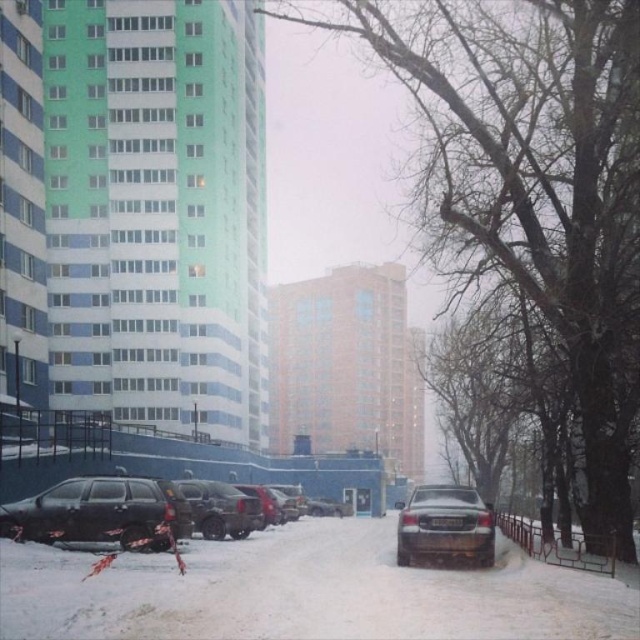
Question: Which object is positioned farthest from the dark brown matte suv at center?

Choices:
 (A) dark gray matte car at center
 (B) dark gray matte suv at lower left

Answer: (A)

Question: Does dark brown matte suv at center have a larger size compared to dark gray matte truck at center?

Choices:
 (A) yes
 (B) no

Answer: (A)

Question: Which point is farther to the camera?

Choices:
 (A) (211, 538)
 (B) (84, 504)
 (C) (424, 548)
 (D) (307, 500)

Answer: (D)

Question: Is dark gray matte car at center smaller than dark brown matte suv at center?

Choices:
 (A) yes
 (B) no

Answer: (B)

Question: Considering the relative positions of dark gray matte suv at lower left and dark gray matte truck at center in the image provided, where is dark gray matte suv at lower left located with respect to dark gray matte truck at center?

Choices:
 (A) right
 (B) left

Answer: (B)

Question: Which point is closer to the camera?

Choices:
 (A) (198, 513)
 (B) (328, 512)
 (C) (413, 506)
 (D) (144, 506)

Answer: (C)